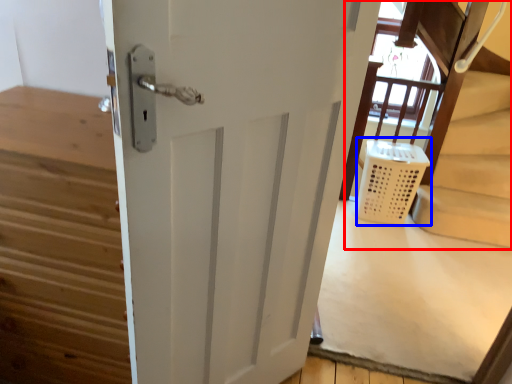
Question: Which object appears farthest to the camera in this image, bunk bed (highlighted by a red box) or laundry basket (highlighted by a blue box)?

Choices:
 (A) bunk bed
 (B) laundry basket

Answer: (B)